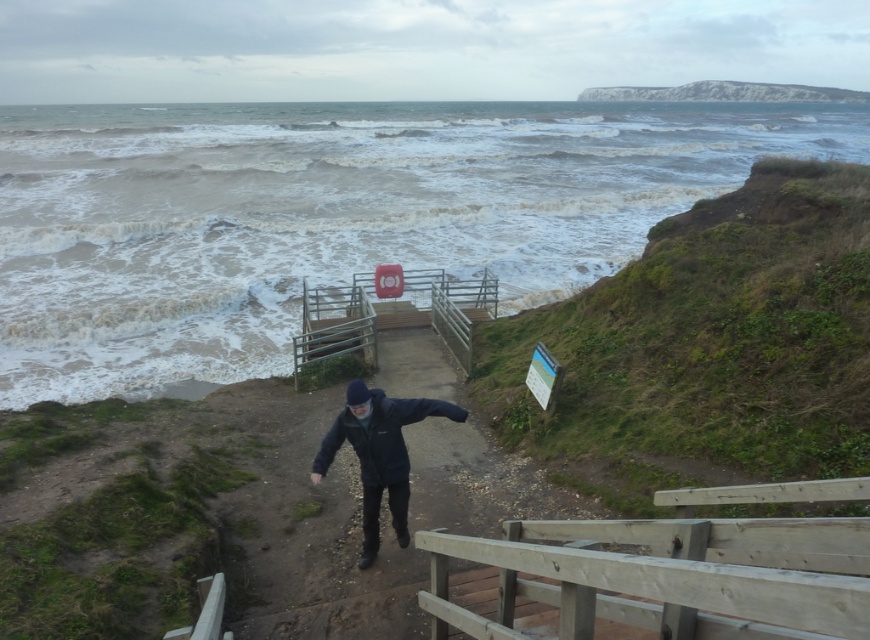
You are standing at the top of the stairs and notice the wooden at center and the dark blue jacket at center. Which object is positioned to the right when facing downward towards the sea?

The wooden at center is to the right of the dark blue jacket at center when facing downward towards the sea.

You are standing at the top of the stairs and want to walk towards the green grassy cliff at right and the white rocky cliff at upper right. Which cliff will you reach first?

You will reach the green grassy cliff at right first because it is closer to you than the white rocky cliff at upper right.

You are a painter standing at the top of the stairs and want to sketch the dark blue jacket at center and the wooden balustrade at lower right. Which object is shorter in height?

The wooden balustrade at lower right is shorter in height compared to the dark blue jacket at center.